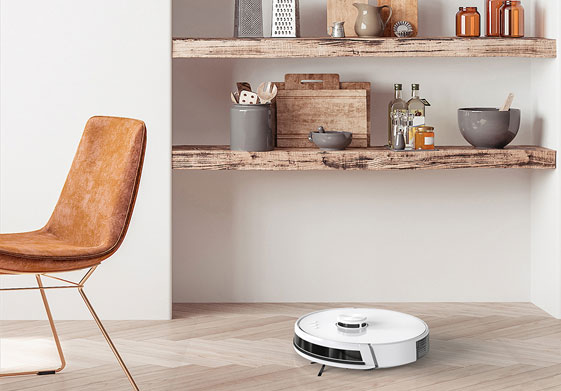
I want to click on bottle, so [397, 103].